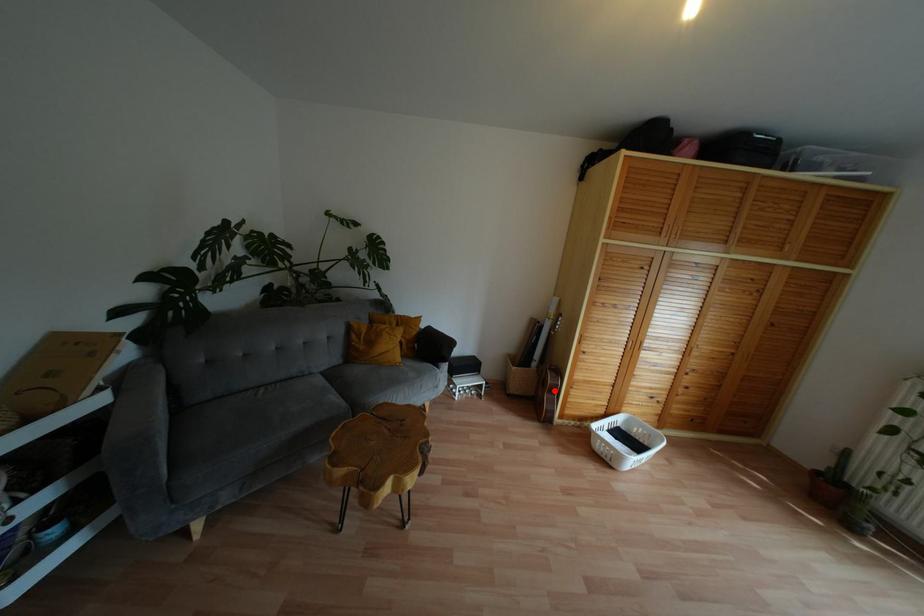
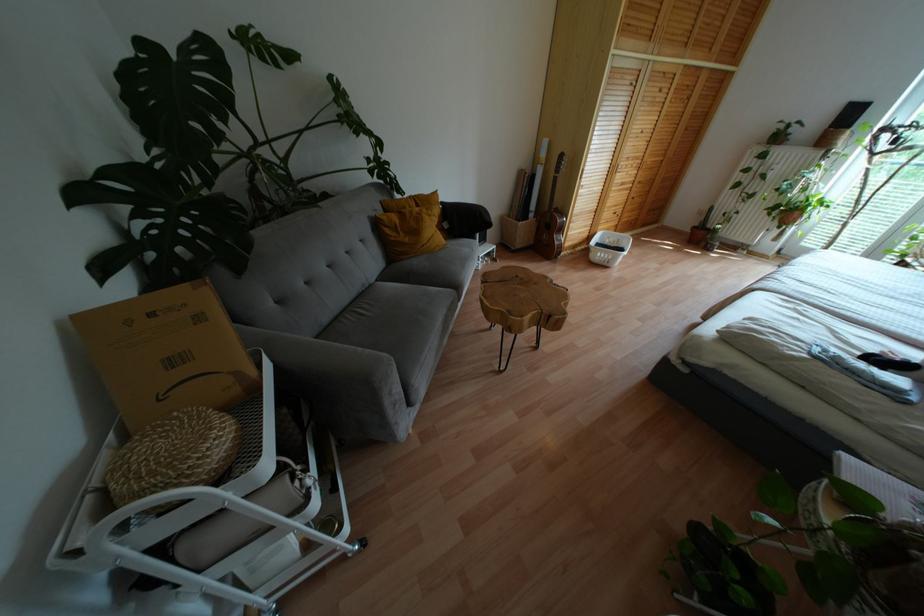
Question: I am providing you with two images of the same scene from different viewpoints. Given a red point in image1, look at the same physical point in image2. Is it:

Choices:
 (A) Closer to the viewpoint
 (B) Farther from the viewpoint

Answer: (A)